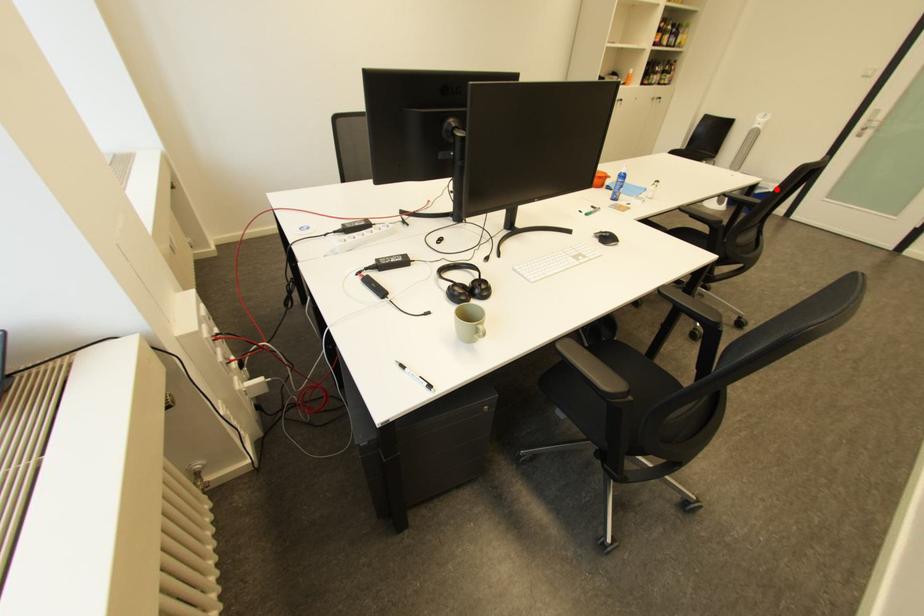
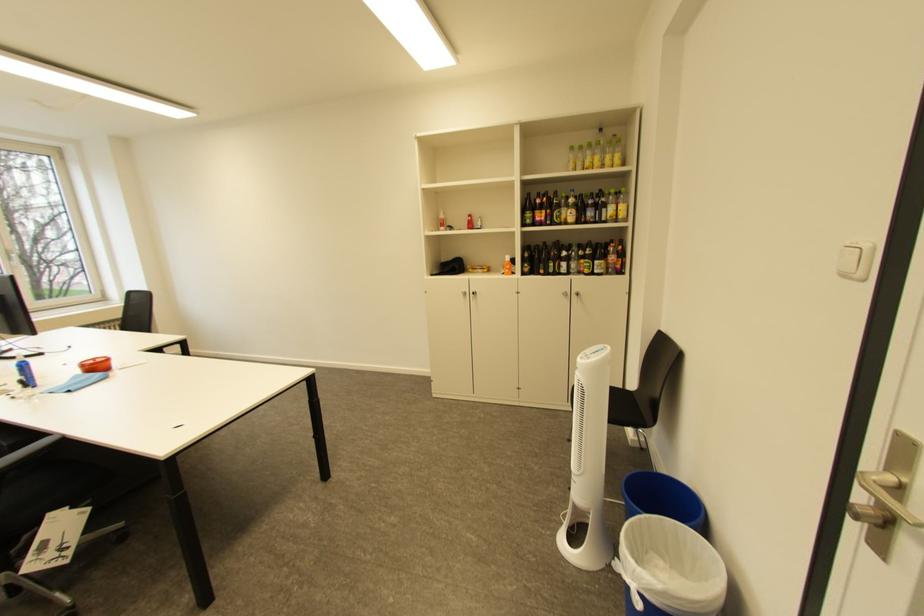
Question: I am providing you with two images of the same scene from different viewpoints. A red point is marked on the first image. At the location where the point appears in image 1, is it still visible in image 2?

Choices:
 (A) Yes
 (B) No

Answer: (A)